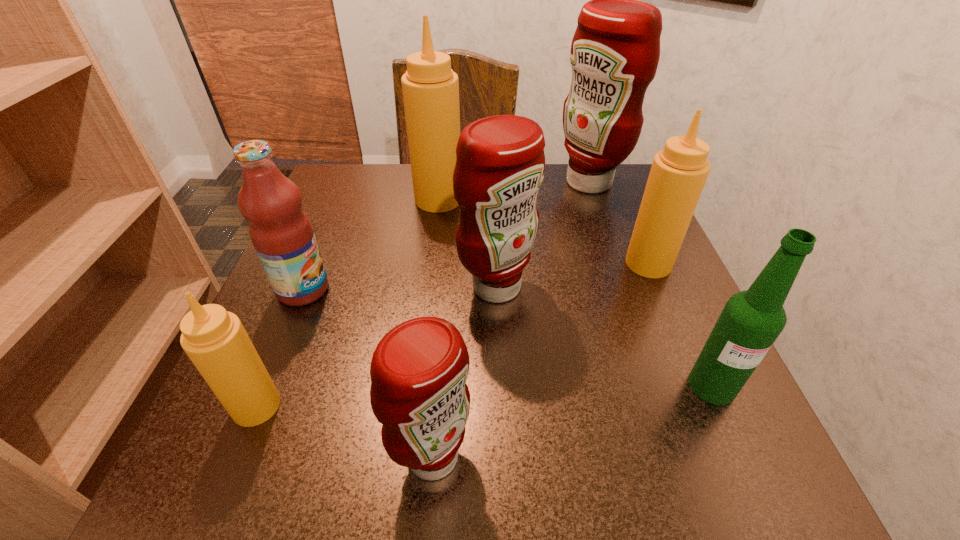
Identify the location of the farthest red condiment. pos(615,51).

Locate an element on the screen. This screenshot has height=540, width=960. the rightmost red condiment is located at coordinates (615, 51).

This screenshot has width=960, height=540. In order to click on the second tan condiment from left to right in this screenshot , I will do `click(430, 88)`.

Where is `the biggest tan condiment`? The image size is (960, 540). the biggest tan condiment is located at coordinates (430, 88).

Image resolution: width=960 pixels, height=540 pixels. Identify the location of the second nearest tan condiment. (678, 174).

Locate an element on the screen. The width and height of the screenshot is (960, 540). the second smallest tan condiment is located at coordinates pos(678,174).

Locate an element on the screen. The image size is (960, 540). the second nearest red condiment is located at coordinates (500, 164).

This screenshot has height=540, width=960. In order to click on fruit juice in this screenshot , I will do `click(281, 232)`.

Where is `beer bottle`? This screenshot has width=960, height=540. beer bottle is located at coordinates (751, 321).

This screenshot has width=960, height=540. In order to click on the leftmost condiment in this screenshot , I will do `click(214, 339)`.